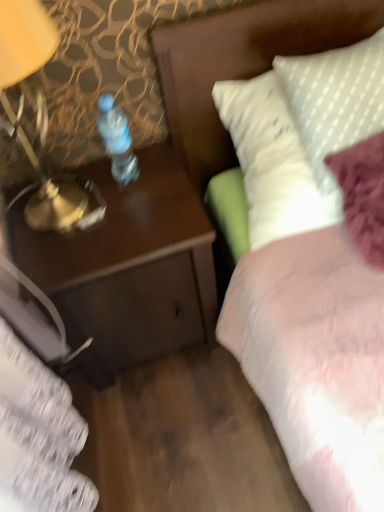
You are a GUI agent. You are given a task and a screenshot of the screen. Output one action in this format:
    pyautogui.click(x=<x>, y=<y>)
    Task: Click on the free space in front of clear plastic bottle at center
    This screenshot has width=384, height=512.
    Given the screenshot: What is the action you would take?
    pyautogui.click(x=126, y=218)